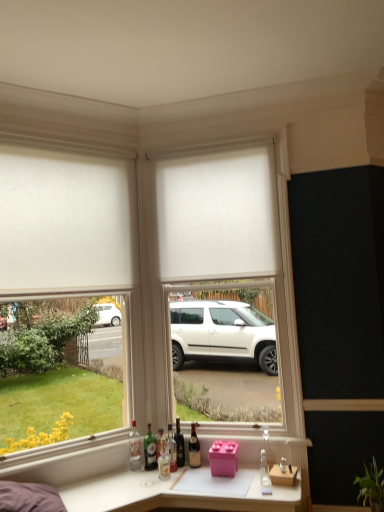
In order to click on free space in front of green glass bottle at lower center, marked as the sixth bottle in a right-to-left arrangement in this screenshot , I will do `click(145, 476)`.